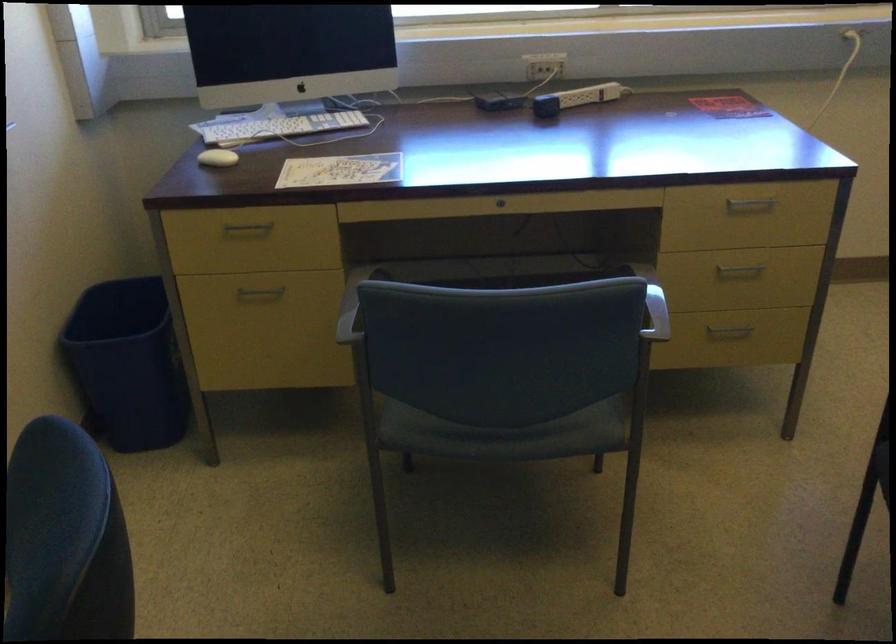
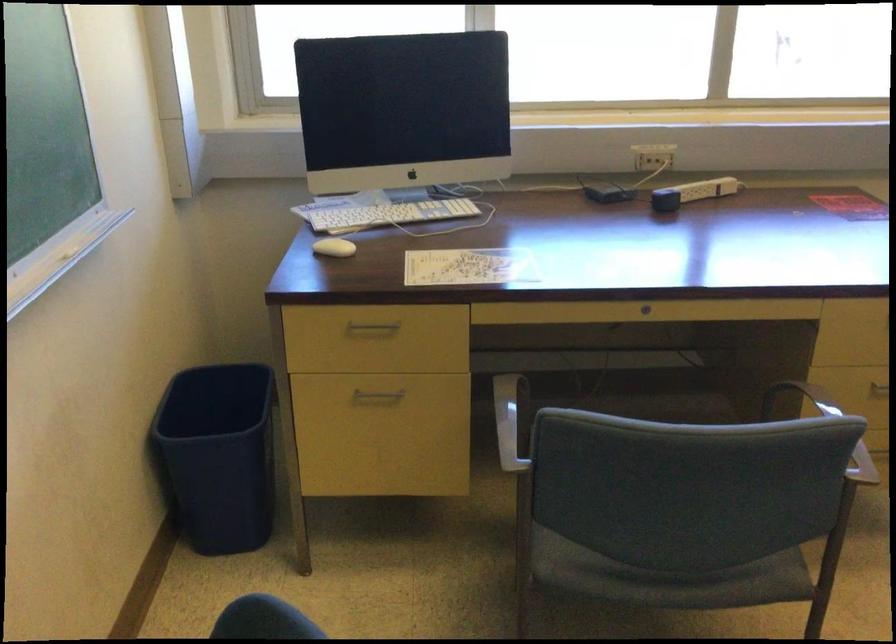
The point at (547, 68) is marked in the first image. Where is the corresponding point in the second image?

(658, 156)